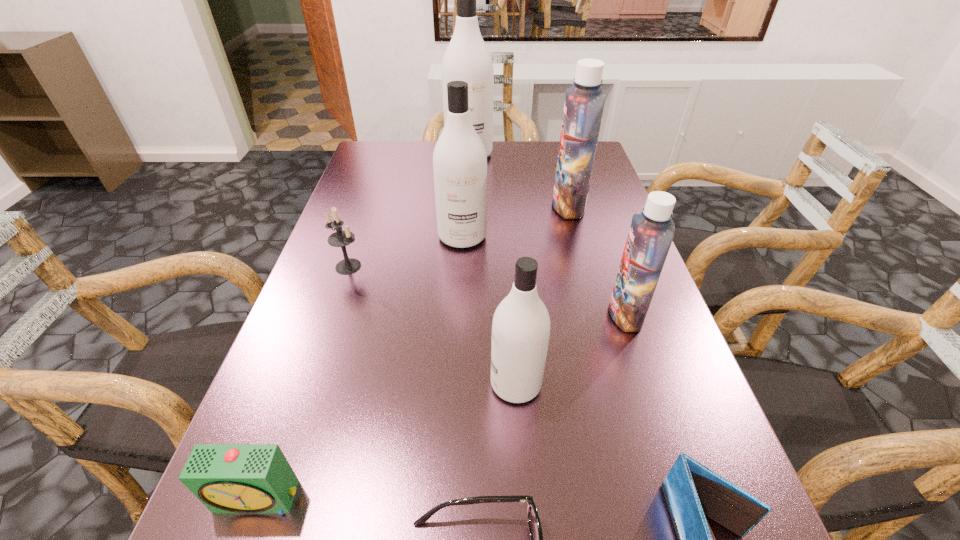
Image resolution: width=960 pixels, height=540 pixels. Identify the location of vacant space located on the front-facing side of the fourth nearest object. (403, 384).

Identify the location of free space located 0.230m on the front-facing side of the fourth nearest object. The image size is (960, 540). (356, 384).

Where is `vacant space situated 0.340m on the right of the candle holder`? The height and width of the screenshot is (540, 960). vacant space situated 0.340m on the right of the candle holder is located at coordinates (517, 266).

The width and height of the screenshot is (960, 540). I want to click on object present at the far edge, so click(467, 58).

Locate an element on the screen. The height and width of the screenshot is (540, 960). candle holder that is positioned at the left edge is located at coordinates (341, 238).

Where is `alarm clock that is at the left edge`? This screenshot has height=540, width=960. alarm clock that is at the left edge is located at coordinates (227, 478).

Where is `vacant area at the far edge of the desktop`? vacant area at the far edge of the desktop is located at coordinates (542, 172).

Where is `blank space at the left edge of the desktop`? This screenshot has width=960, height=540. blank space at the left edge of the desktop is located at coordinates (350, 305).

The image size is (960, 540). In the image, there is a desktop. Identify the location of vacant space at the right edge. (694, 434).

What are the coordinates of `free point between the nearest white shampoo and the second nearest white shampoo` in the screenshot? It's located at (489, 310).